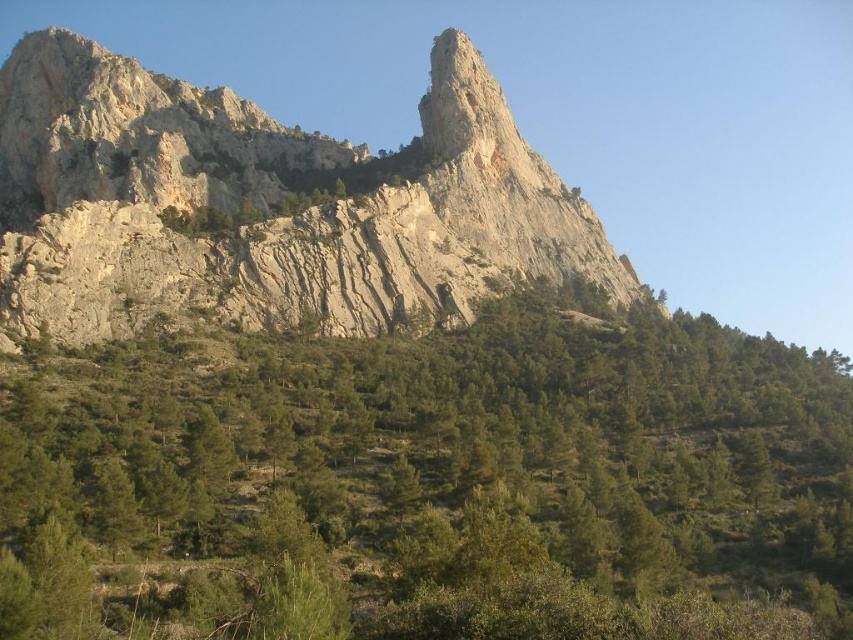
You are a hiker standing at the base of the mountain. You see the green leafy trees at lower center. Where would you look to find them?

The green leafy trees at lower center are located at the 2D coordinates point (430,484), which is towards the lower center of the image.

You are planning to set up a campsite in the area shown in the image. Considering the green leafy trees at lower center and the rugged stone mountain at center, which object would provide better natural shade for your campsite? Explain your reasoning based on their positions.

The green leafy trees at lower center would provide better natural shade for the campsite because they are positioned under the rugged stone mountain at center, meaning the trees are closer to the ground level where the campsite would be located. The mountain, being higher, might cast shadows but the trees directly overhead would offer more immediate and consistent shade.

You are a hiker standing at the base of the rugged stone mountain at center and want to reach the green leafy trees at lower center. Which direction should you move to get closer to the trees?

The green leafy trees at lower center are closer to the viewer than the rugged stone mountain at center. To reach them, you should move forward towards the base of the rugged stone mountain at center where the trees are located.